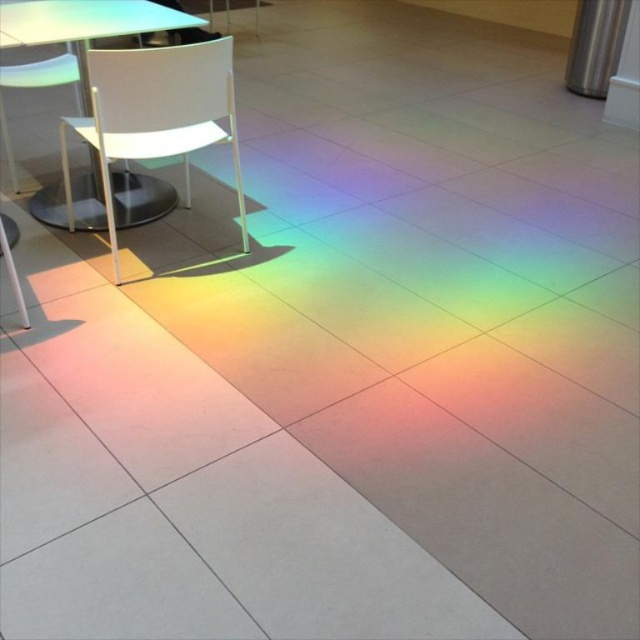
Question: Can you confirm if white plastic chair at upper left is bigger than white plastic table at upper left?

Choices:
 (A) no
 (B) yes

Answer: (B)

Question: Which point is closer to the camera?

Choices:
 (A) (141, 108)
 (B) (22, 28)

Answer: (A)

Question: Observing the image, what is the correct spatial positioning of white plastic chair at upper left in reference to white plastic table at upper left?

Choices:
 (A) left
 (B) right

Answer: (B)

Question: Does white plastic chair at upper left lie behind white plastic table at upper left?

Choices:
 (A) yes
 (B) no

Answer: (B)